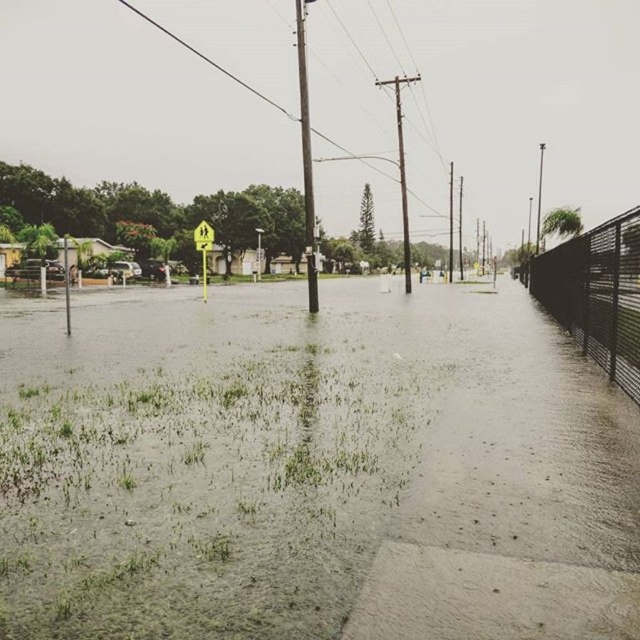
Question: Is black metal fence at right to the left of yellow plastic sign at center from the viewer's perspective?

Choices:
 (A) no
 (B) yes

Answer: (A)

Question: Does muddy water at center have a smaller size compared to black metal fence at right?

Choices:
 (A) yes
 (B) no

Answer: (A)

Question: Which point appears closest to the camera in this image?

Choices:
 (A) (204, 285)
 (B) (138, 484)

Answer: (B)

Question: Which point appears closest to the camera in this image?

Choices:
 (A) (611, 310)
 (B) (205, 240)
 (C) (84, 448)

Answer: (C)

Question: Based on their relative distances, which object is nearer to the black metal fence at right?

Choices:
 (A) yellow plastic sign at center
 (B) muddy water at center

Answer: (B)

Question: Is black metal fence at right closer to camera compared to yellow plastic sign at center?

Choices:
 (A) yes
 (B) no

Answer: (A)